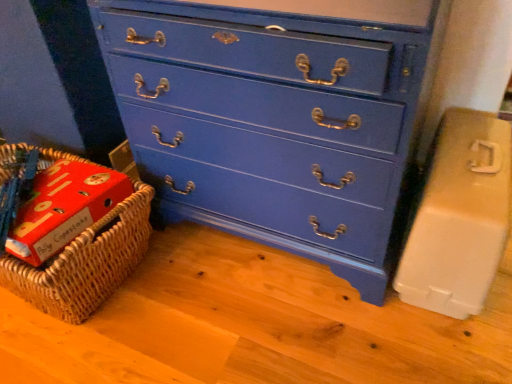
The width and height of the screenshot is (512, 384). I want to click on vacant space to the left of beige plastic container at right, so click(328, 306).